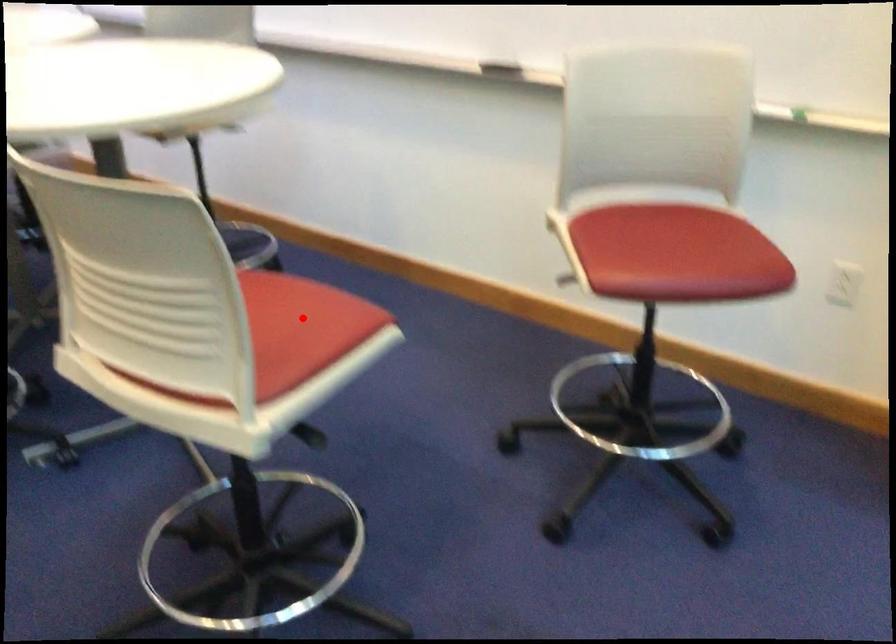
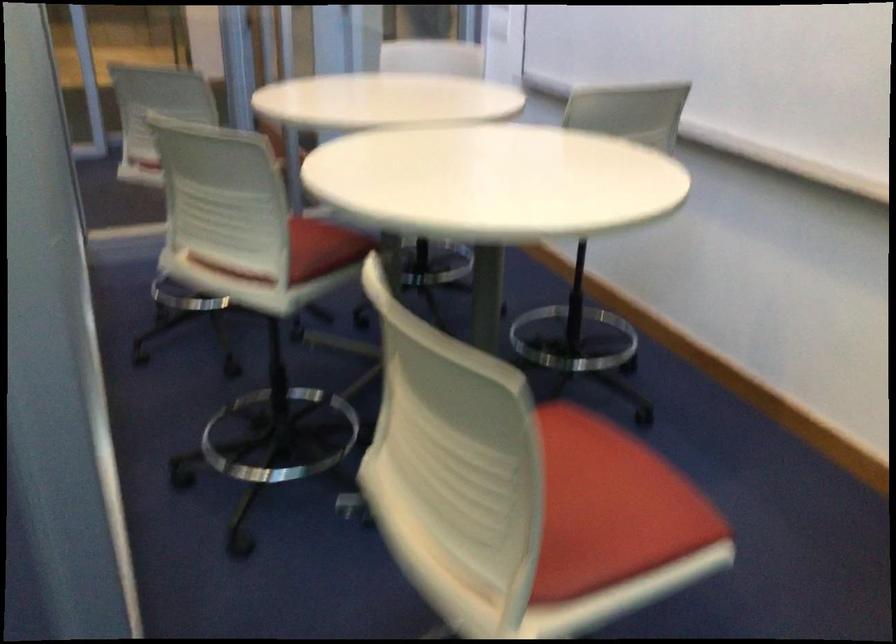
In the second image, find the point that corresponds to the highlighted location in the first image.

(609, 507)